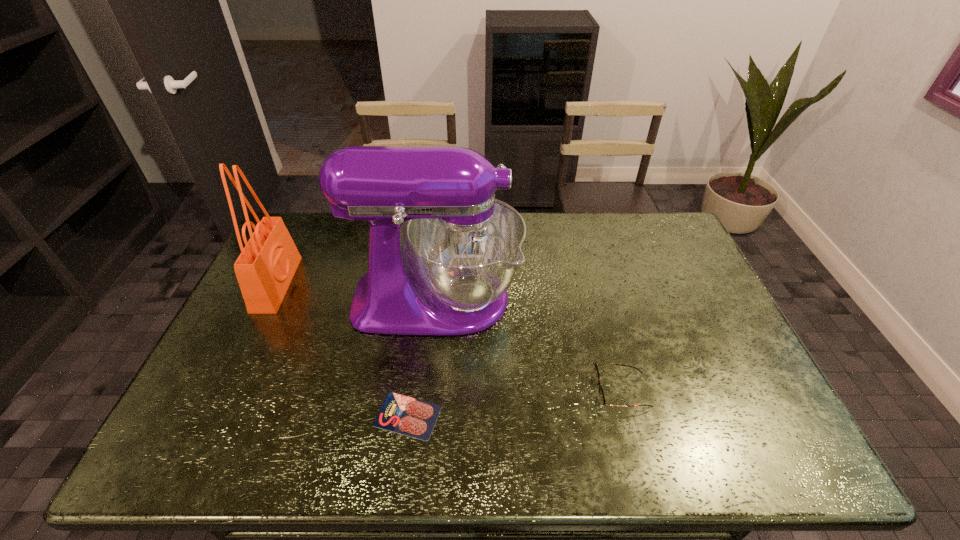
You are a GUI agent. You are given a task and a screenshot of the screen. Output one action in this format:
    pyautogui.click(x=<x>, y=<y>)
    Task: Click on the free region that satisfies the following two spatial constraints: 1. on the logo side of the leftmost object; 2. on the back side of the shortest object
    
    Given the screenshot: What is the action you would take?
    pyautogui.click(x=213, y=415)

Image resolution: width=960 pixels, height=540 pixels. What are the coordinates of `vacant region that satisfies the following two spatial constraints: 1. on the logo side of the third shortest object; 2. on the back side of the salami` in the screenshot? It's located at (213, 415).

You are a GUI agent. You are given a task and a screenshot of the screen. Output one action in this format:
    pyautogui.click(x=<x>, y=<y>)
    Task: Click on the free location that satisfies the following two spatial constraints: 1. on the back side of the salami; 2. on the logo side of the leftmost object
    The image size is (960, 540).
    Given the screenshot: What is the action you would take?
    pyautogui.click(x=425, y=284)

At what (x,y) coordinates should I click in order to perform the action: click on free region that satisfies the following two spatial constraints: 1. on the logo side of the leftmost object; 2. on the back side of the salami. Please return your answer as a coordinate pair (x, y). Looking at the image, I should click on (213, 415).

Find the location of a particular element. This screenshot has width=960, height=540. vacant position in the image that satisfies the following two spatial constraints: 1. on the logo side of the second tallest object; 2. on the back side of the shortest object is located at coordinates (213, 415).